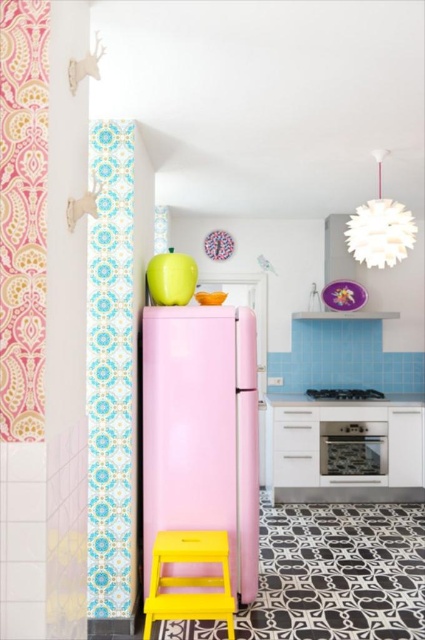
Question: Is pink fabric curtain at left smaller than satin silver oven at center?

Choices:
 (A) yes
 (B) no

Answer: (A)

Question: Considering the real-world distances, which object is closest to the satin silver oven at center?

Choices:
 (A) yellow plastic stool at lower left
 (B) pink fabric curtain at left

Answer: (A)

Question: From the image, what is the correct spatial relationship of pink fabric curtain at left in relation to yellow plastic stool at lower left?

Choices:
 (A) left
 (B) right

Answer: (A)

Question: Does glossy pink refrigerator at center lie in front of satin silver oven at center?

Choices:
 (A) yes
 (B) no

Answer: (A)

Question: Which point is farther to the camera?

Choices:
 (A) (149, 554)
 (B) (30, 253)
 (C) (183, 602)
 (D) (365, 397)

Answer: (D)

Question: Which object is closer to the camera taking this photo?

Choices:
 (A) glossy pink refrigerator at center
 (B) satin silver oven at center
 (C) pink fabric curtain at left

Answer: (C)